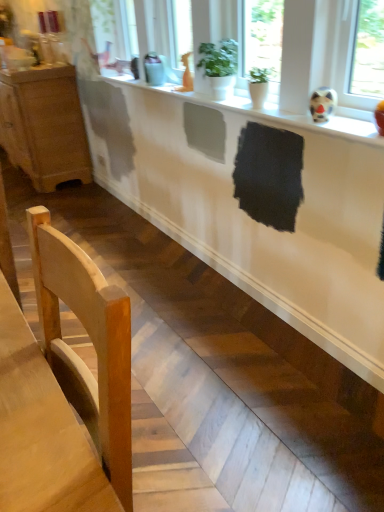
Question: Considering the relative sizes of white glossy counter at lower center and wooden cabinet at left in the image provided, is white glossy counter at lower center wider than wooden cabinet at left?

Choices:
 (A) no
 (B) yes

Answer: (A)

Question: From a real-world perspective, is white glossy counter at lower center located beneath wooden cabinet at left?

Choices:
 (A) yes
 (B) no

Answer: (A)

Question: From the image's perspective, is white glossy counter at lower center located beneath wooden cabinet at left?

Choices:
 (A) no
 (B) yes

Answer: (B)

Question: Can you confirm if white glossy counter at lower center is positioned to the right of wooden cabinet at left?

Choices:
 (A) no
 (B) yes

Answer: (B)

Question: Is white glossy counter at lower center not inside wooden cabinet at left?

Choices:
 (A) no
 (B) yes

Answer: (B)

Question: Is white glossy counter at lower center taller than wooden cabinet at left?

Choices:
 (A) no
 (B) yes

Answer: (A)

Question: Is green matte plant at upper center at the right side of white matte counter top at upper center?

Choices:
 (A) yes
 (B) no

Answer: (A)

Question: Is green matte plant at upper center wider than white matte counter top at upper center?

Choices:
 (A) yes
 (B) no

Answer: (B)

Question: Is green matte plant at upper center positioned before white matte counter top at upper center?

Choices:
 (A) no
 (B) yes

Answer: (A)

Question: Is green matte plant at upper center completely or partially outside of white matte counter top at upper center?

Choices:
 (A) no
 (B) yes

Answer: (B)

Question: Considering the relative sizes of green matte plant at upper center and white matte counter top at upper center in the image provided, is green matte plant at upper center thinner than white matte counter top at upper center?

Choices:
 (A) yes
 (B) no

Answer: (A)

Question: Is green matte plant at upper center shorter than white matte counter top at upper center?

Choices:
 (A) yes
 (B) no

Answer: (B)

Question: Is wooden cabinet at left aimed at light wood chair at lower left?

Choices:
 (A) yes
 (B) no

Answer: (B)